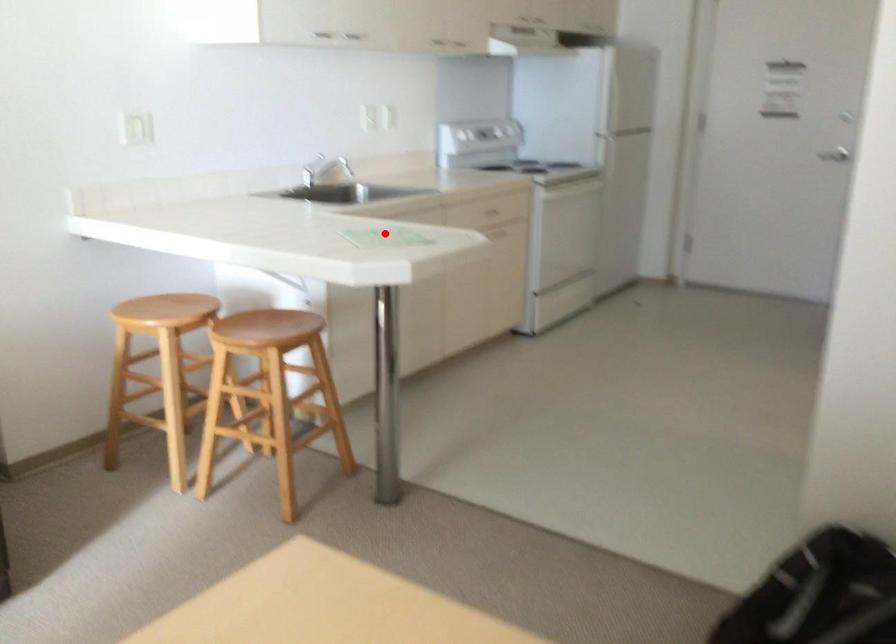
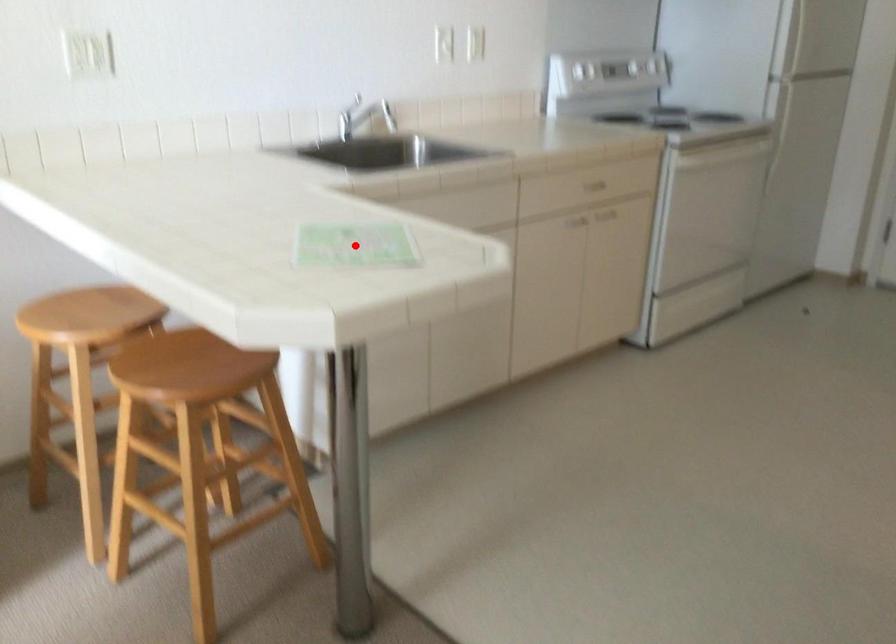
I am providing you with two images of the same scene from different viewpoints. A red point is marked on the first image and another point is marked on the second image. Is the marked point in image1 the same physical position as the marked point in image2?

Yes